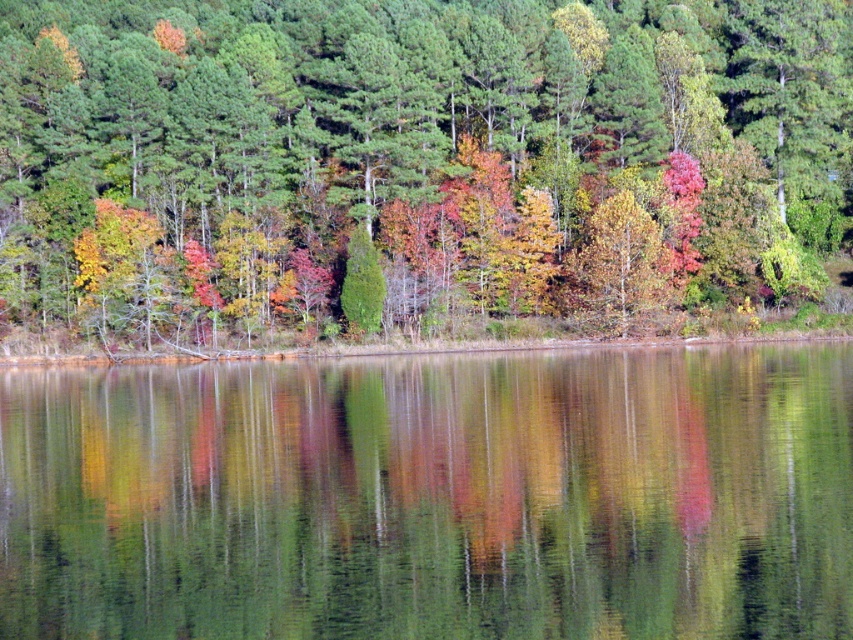
You are standing on a path near the water and want to take a photo of the multicolored foliage at center and transparent water at center. If your camera can focus on objects up to 20 meters away, will both subjects be in focus?

The multicolored foliage at center is 25.47 meters from transparent water at center. Since the foliage is beyond the 20 meters focus range, it won t be in focus. The water might be in focus if it s within 20 meters, but the foliage will be blurry.

You are standing at the edge of the water in the serene landscape scene. You notice two points marked in the image. The first point is at coordinates point (184, 336) and the second is at point (595, 246). Which of these two points is closer to you?

Point (184, 336) is in front of point (595, 246), so it is closer to you.